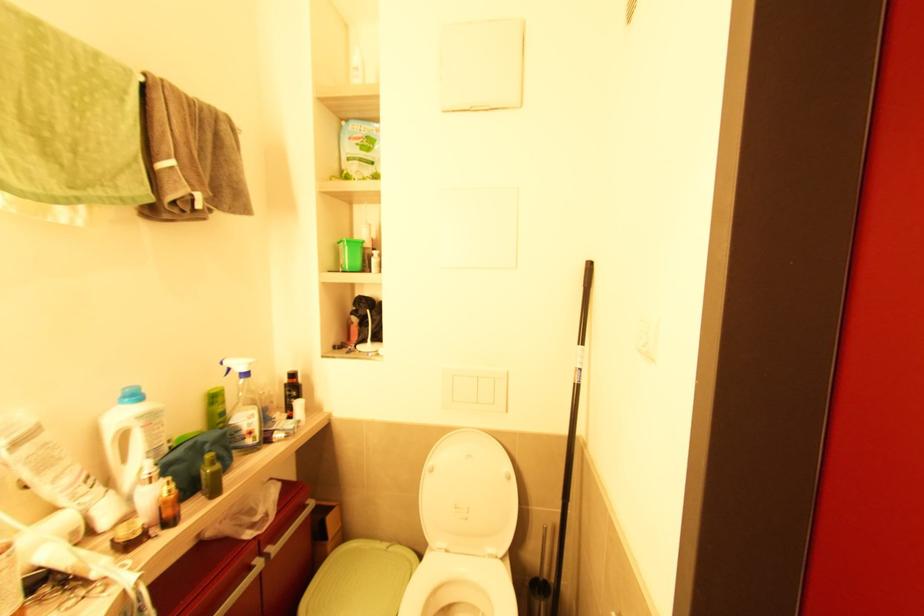
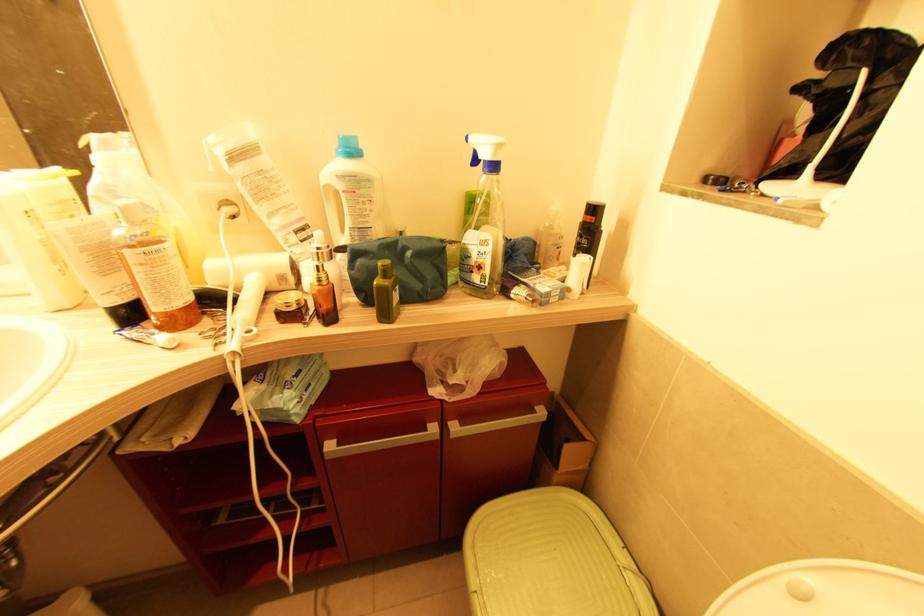
How did the camera likely rotate?

The camera's rotation is toward left-down.